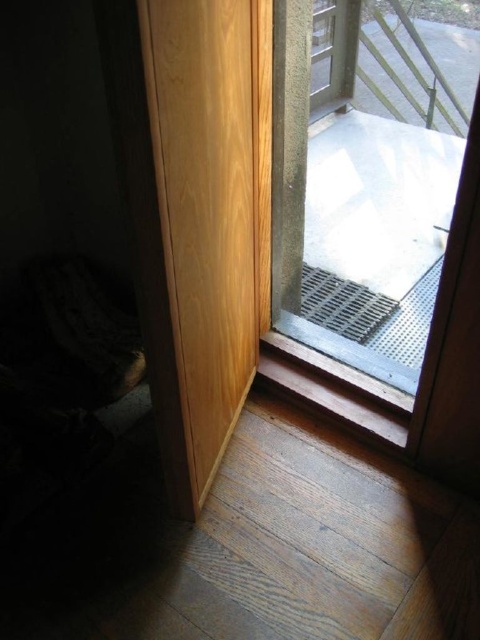
Can you confirm if transparent glass door at upper right is positioned to the right of light wood door at left?

Indeed, transparent glass door at upper right is positioned on the right side of light wood door at left.

Where is `transparent glass door at upper right`? This screenshot has height=640, width=480. transparent glass door at upper right is located at coordinates (364, 179).